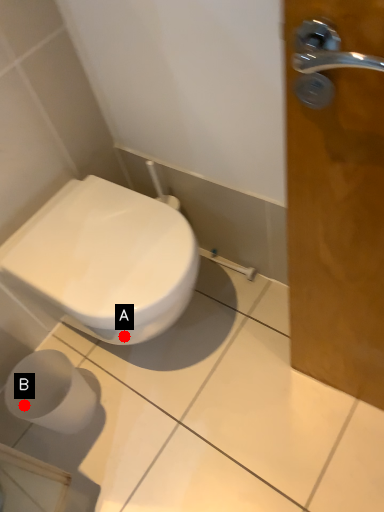
Question: Two points are circled on the image, labeled by A and B beside each circle. Which point appears farthest from the camera in this image?

Choices:
 (A) A is further
 (B) B is further

Answer: (B)